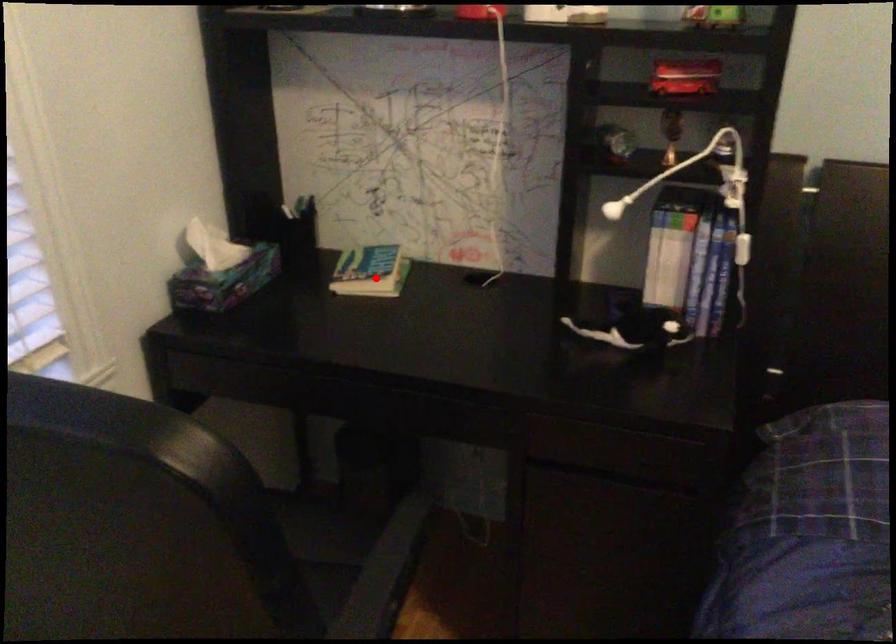
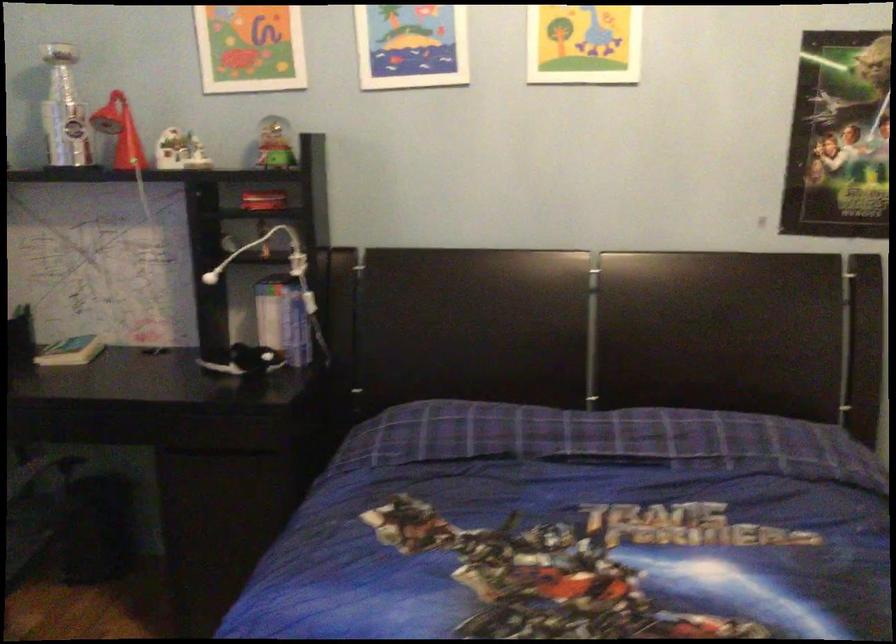
Find the pixel in the second image that matches the highlighted location in the first image.

(71, 351)